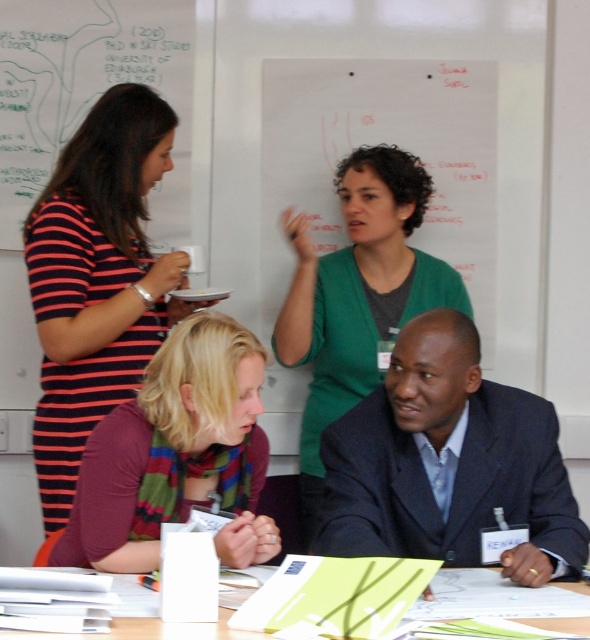
Question: Which point is closer to the camera taking this photo?

Choices:
 (A) (186, 301)
 (B) (366, 211)
 (C) (211, 627)
 (D) (109, 541)

Answer: (C)

Question: Can you confirm if striped fabric dress at left is thinner than multicolored scarf at center?

Choices:
 (A) no
 (B) yes

Answer: (B)

Question: In this image, where is dark blue suit at center located relative to green paper at lower center?

Choices:
 (A) above
 (B) below

Answer: (A)

Question: Can you confirm if striped fabric dress at left is bigger than green matte sweater at upper center?

Choices:
 (A) yes
 (B) no

Answer: (B)

Question: Which of these objects is positioned farthest from the dark blue suit at center?

Choices:
 (A) green paper at lower center
 (B) striped fabric dress at left
 (C) multicolored scarf at center
 (D) green matte sweater at upper center

Answer: (D)

Question: Which point is farther to the camera?

Choices:
 (A) (63, 488)
 (B) (434, 412)

Answer: (A)